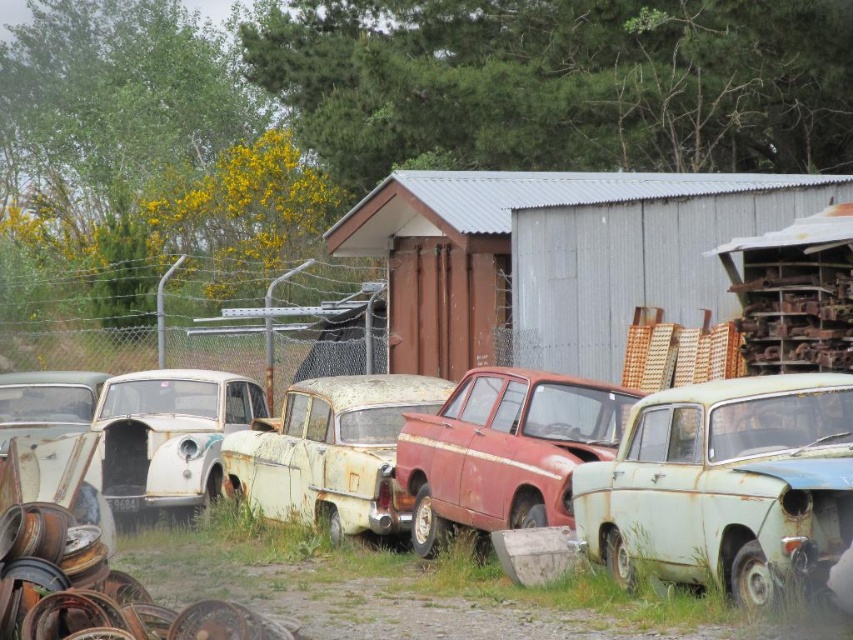
Image resolution: width=853 pixels, height=640 pixels. Find the location of `rusty metal car at center`. rusty metal car at center is located at coordinates (329, 452).

Which is more to the right, rusty metal car at center or rusty metal car at left?

From the viewer's perspective, rusty metal car at center appears more on the right side.

You are a GUI agent. You are given a task and a screenshot of the screen. Output one action in this format:
    pyautogui.click(x=<x>, y=<y>)
    Task: Click on the rusty metal car at center
    This screenshot has height=640, width=853.
    Given the screenshot: What is the action you would take?
    pyautogui.click(x=329, y=452)

I want to click on rusty metal car at center, so click(x=329, y=452).

Between rusty corrugated metal hut at center and rusty matte car at center, which one is positioned higher?

rusty corrugated metal hut at center

Is rusty corrugated metal hut at center positioned in front of rusty matte car at center?

No, rusty corrugated metal hut at center is further to the viewer.

Is point (693, 308) closer to camera compared to point (421, 500)?

No, it is not.

The height and width of the screenshot is (640, 853). I want to click on rusty corrugated metal hut at center, so click(555, 257).

The image size is (853, 640). Describe the element at coordinates (724, 484) in the screenshot. I see `green matte car at lower right` at that location.

You are a GUI agent. You are given a task and a screenshot of the screen. Output one action in this format:
    pyautogui.click(x=<x>, y=<y>)
    Task: Click on the green matte car at lower right
    This screenshot has width=853, height=640.
    Given the screenshot: What is the action you would take?
    pyautogui.click(x=724, y=484)